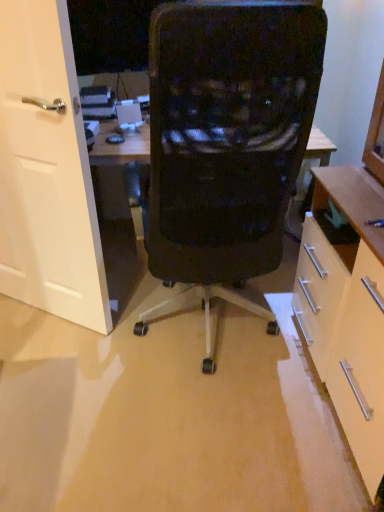
I want to click on free area in between matte white cabinet at right and black mesh chair at center, so click(x=255, y=431).